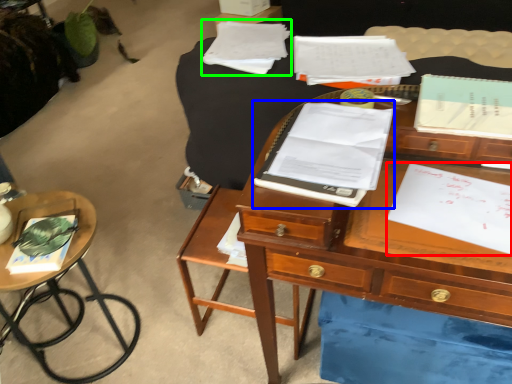
Question: Which object is positioned closest to document (highlighted by a red box)? Select from notebook (highlighted by a blue box) and notebook (highlighted by a green box).

Choices:
 (A) notebook
 (B) notebook

Answer: (A)